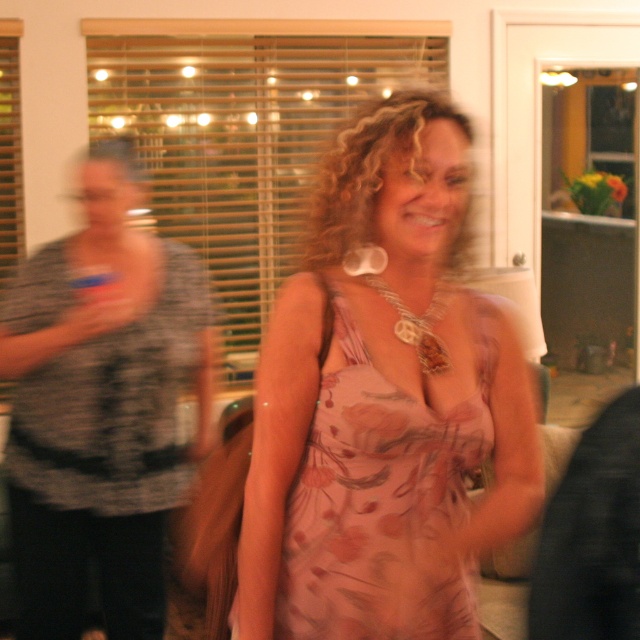
Question: Which point is farther to the camera?

Choices:
 (A) floral silk dress at center
 (B) silver metallic necklace at center

Answer: (B)

Question: Among these points, which one is nearest to the camera?

Choices:
 (A) (412, 337)
 (B) (355, 371)

Answer: (B)

Question: Considering the relative positions of floral silk dress at center and silver metallic necklace at center in the image provided, where is floral silk dress at center located with respect to silver metallic necklace at center?

Choices:
 (A) above
 (B) below

Answer: (B)

Question: Does floral silk dress at center have a larger size compared to silver metallic necklace at center?

Choices:
 (A) no
 (B) yes

Answer: (B)

Question: Observing the image, what is the correct spatial positioning of floral silk dress at center in reference to silver metallic necklace at center?

Choices:
 (A) above
 (B) below

Answer: (B)